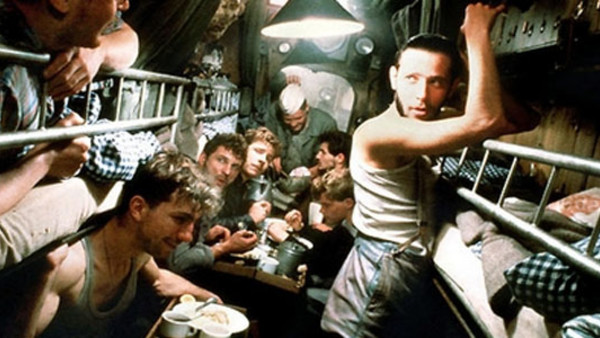
The height and width of the screenshot is (338, 600). Identify the location of light. (294, 11).